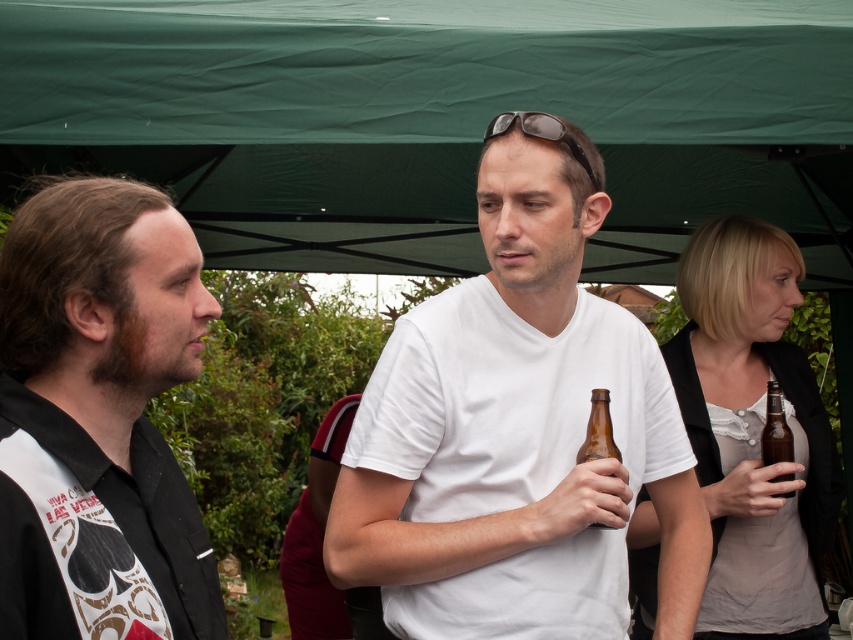
Question: Estimate the real-world distances between objects in this image. Which object is farther from the black matte sunglasses at center?

Choices:
 (A) brown glass bottle at right
 (B) matte gray shirt at right
 (C) brown glass bottle at center
 (D) green fabric canopy at upper center

Answer: (D)

Question: Is white matte t-shirt at center positioned at the back of black matte sunglasses at center?

Choices:
 (A) yes
 (B) no

Answer: (A)

Question: Is green fabric canopy at upper center smaller than matte gray shirt at right?

Choices:
 (A) yes
 (B) no

Answer: (B)

Question: Among these objects, which one is nearest to the camera?

Choices:
 (A) black matte shirt at left
 (B) white matte t-shirt at center
 (C) matte gray shirt at right

Answer: (A)

Question: Which point is farther to the camera?

Choices:
 (A) (618, 506)
 (B) (556, 140)

Answer: (A)

Question: Where is black matte shirt at left located in relation to matte gray shirt at right in the image?

Choices:
 (A) right
 (B) left

Answer: (B)